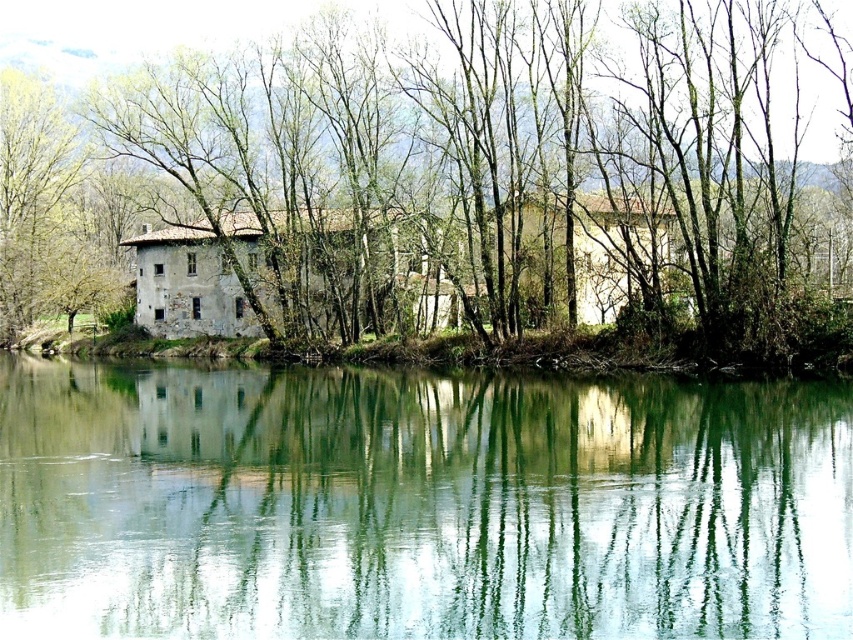
Question: Does green reflective water at center have a smaller size compared to green leafy tree at center?

Choices:
 (A) yes
 (B) no

Answer: (A)

Question: Observing the image, what is the correct spatial positioning of green reflective water at center in reference to green leafy tree at center?

Choices:
 (A) above
 (B) below

Answer: (B)

Question: Among these points, which one is nearest to the camera?

Choices:
 (A) (558, 556)
 (B) (80, 65)

Answer: (A)

Question: Does green reflective water at center appear on the right side of green leafy tree at center?

Choices:
 (A) yes
 (B) no

Answer: (A)

Question: Which point is farther from the camera taking this photo?

Choices:
 (A) (833, 147)
 (B) (78, 394)

Answer: (A)